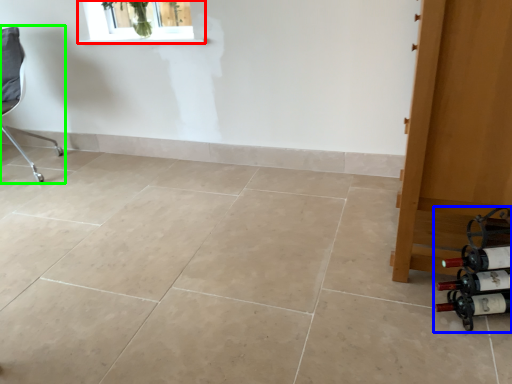
Question: Estimate the real-world distances between objects in this image. Which object is farther from window (highlighted by a red box), wine bottle (highlighted by a blue box) or chair (highlighted by a green box)?

Choices:
 (A) wine bottle
 (B) chair

Answer: (A)